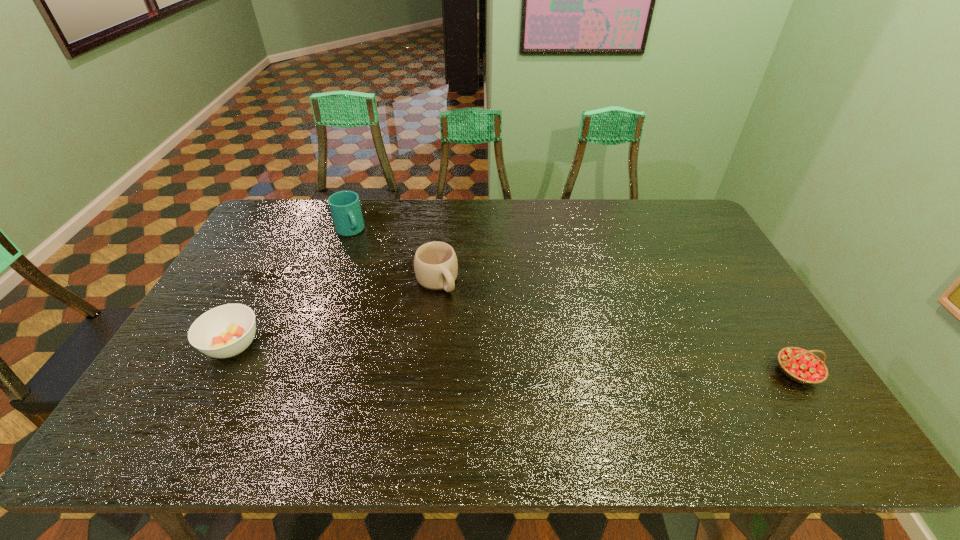
I want to click on free space at the near edge of the desktop, so click(x=446, y=385).

The height and width of the screenshot is (540, 960). I want to click on vacant space at the left edge of the desktop, so click(242, 258).

The height and width of the screenshot is (540, 960). In the image, there is a desktop. Find the location of `free space at the right edge`. free space at the right edge is located at coordinates [697, 266].

Locate an element on the screen. This screenshot has width=960, height=540. vacant region at the far left corner is located at coordinates (280, 209).

Locate an element on the screen. The height and width of the screenshot is (540, 960). vacant point located between the cup and the third nearest object is located at coordinates (394, 256).

At what (x,y) coordinates should I click in order to perform the action: click on free space between the leftmost object and the cup. Please return your answer as a coordinate pair (x, y). Image resolution: width=960 pixels, height=540 pixels. Looking at the image, I should click on (291, 288).

Locate an element on the screen. The image size is (960, 540). unoccupied position between the rightmost object and the soup bowl is located at coordinates (515, 359).

Locate an element on the screen. This screenshot has width=960, height=540. free spot between the third shortest object and the cup is located at coordinates (394, 256).

Where is `vacant area between the farthest object and the leftmost object`? vacant area between the farthest object and the leftmost object is located at coordinates (291, 288).

Locate an element on the screen. This screenshot has width=960, height=540. free space between the strawberry and the leftmost object is located at coordinates (515, 359).